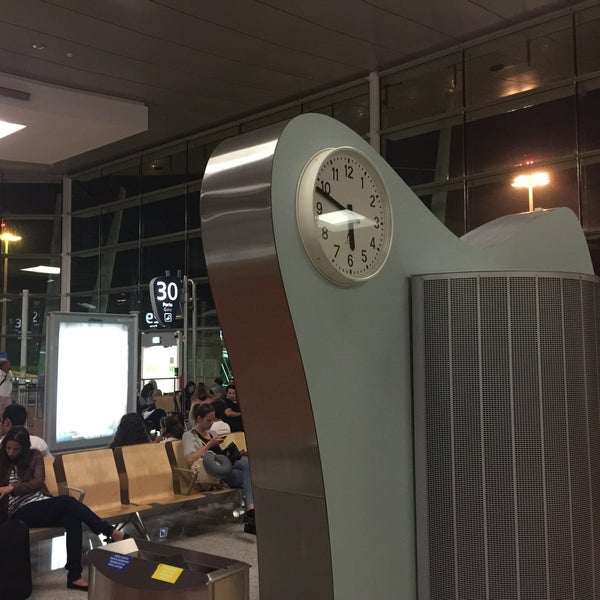
You are a GUI agent. You are given a task and a screenshot of the screen. Output one action in this format:
    pyautogui.click(x=<x>, y=<y>)
    Task: Click on the hour hand of clock
    This screenshot has width=600, height=600.
    Given the screenshot: What is the action you would take?
    [349, 232]